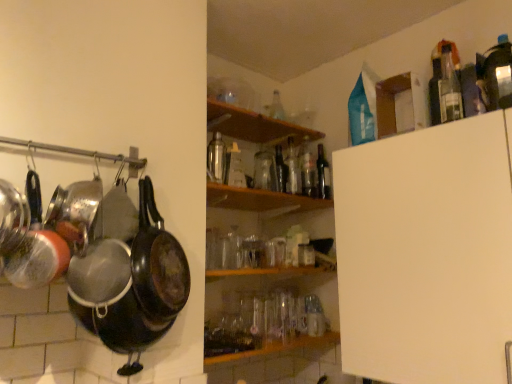
Question: From a real-world perspective, is wooden shelf at center, which ranks as the 1th shelf in bottom-to-top order, physically located above or below transparent glass bottle at center, which ranks as the fourth bottle in front-to-back order?

Choices:
 (A) above
 (B) below

Answer: (B)

Question: Looking at the image, does wooden shelf at center, which ranks as the 1th shelf in bottom-to-top order, seem bigger or smaller compared to transparent glass bottle at center, which is counted as the 3th bottle, starting from the back?

Choices:
 (A) big
 (B) small

Answer: (A)

Question: Considering the real-world distances, which object is closest to the wooden shelf at center, which ranks as the 1th shelf in bottom-to-top order?

Choices:
 (A) transparent glass bottle at center, positioned as the 3th bottle in front-to-back order
 (B) transparent glass bottle at upper center, which is counted as the 5th bottle, starting from the back
 (C) dark glass bottle at upper center, arranged as the 5th bottle when viewed from the left
 (D) clear glass bottle at center, positioned as the 3th bottle in right-to-left order
 (E) black matte frying pan at left

Answer: (A)

Question: Considering the real-world distances, which object is closest to the transparent glass bottle at center, which ranks as the fifth bottle in right-to-left order?

Choices:
 (A) transparent glass bottle at center, which ranks as the fourth bottle in front-to-back order
 (B) wooden shelf at center, which ranks as the 1th shelf in bottom-to-top order
 (C) dark glass bottle at upper center, the sixth bottle viewed from the front
 (D) clear glass bottle at upper right, the sixth bottle positioned from the left
 (E) transparent glass bottle at upper center, which appears as the 6th bottle when viewed from the right

Answer: (A)